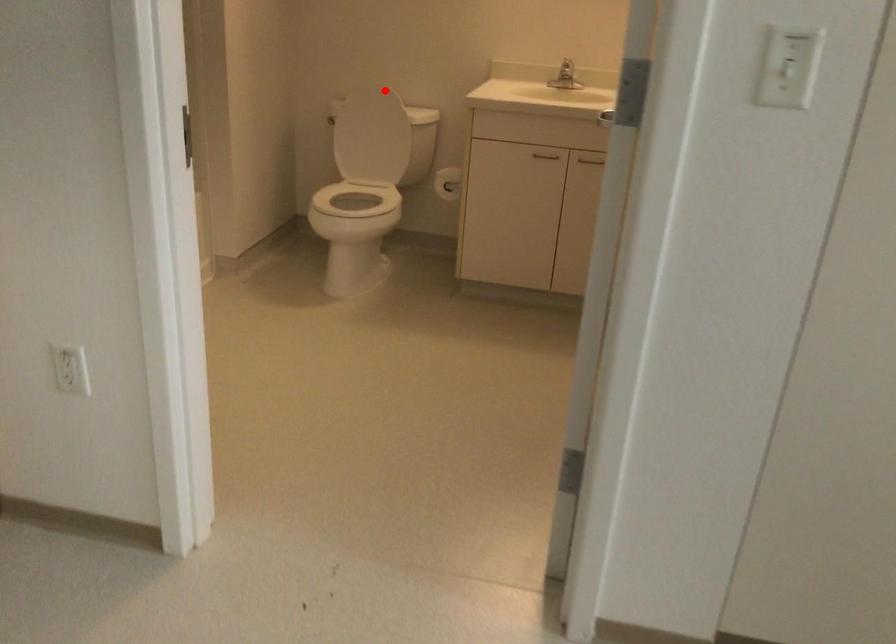
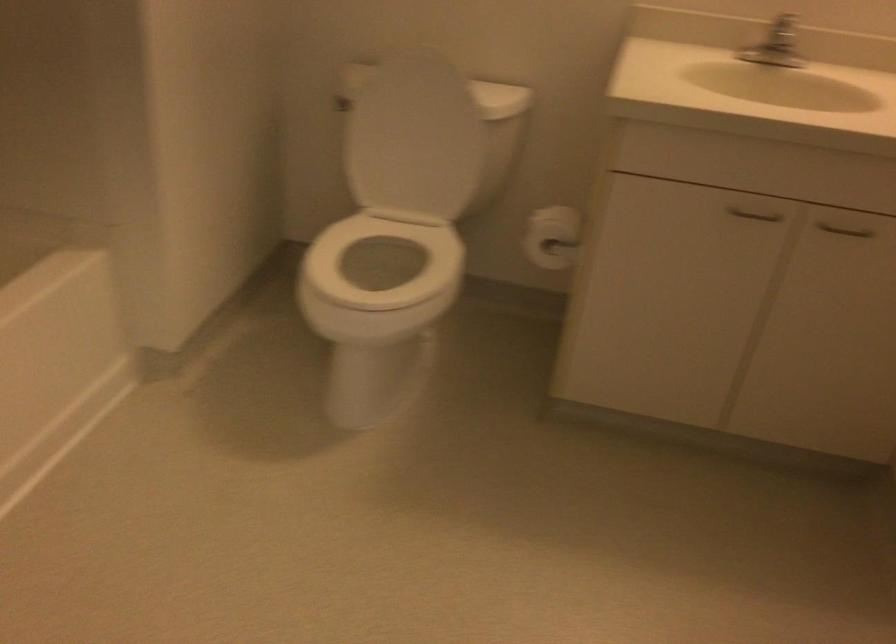
Question: I am providing you with two images of the same scene from different viewpoints. A red point is shown in image1. For the corresponding object point in image2, is it positioned nearer or farther from the camera?

Choices:
 (A) Nearer
 (B) Farther

Answer: (A)